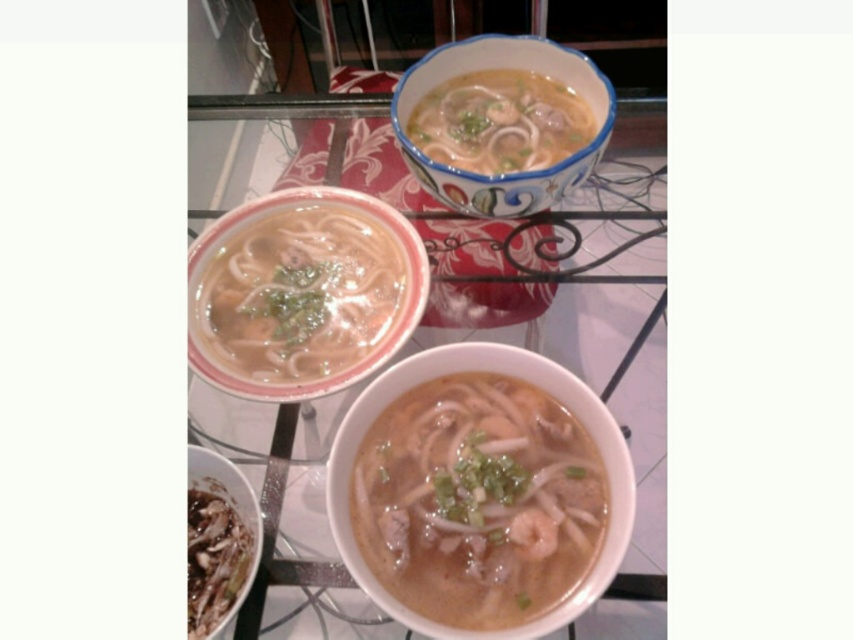
Question: Is white glossy bowl at center thinner than matte white bowl at center?

Choices:
 (A) yes
 (B) no

Answer: (A)

Question: Is matte white bowl at center smaller than decorative ceramic bowl at upper center?

Choices:
 (A) yes
 (B) no

Answer: (A)

Question: Which object is positioned closest to the white glossy bowl at center?

Choices:
 (A) matte white bowl at center
 (B) white glossy bowl at upper center
 (C) brown glossy shrimp at lower left

Answer: (A)

Question: Is white glossy bowl at upper center smaller than glassy white table at center?

Choices:
 (A) yes
 (B) no

Answer: (A)

Question: Estimate the real-world distances between objects in this image. Which object is closer to the white glossy bowl at upper center?

Choices:
 (A) glassy white table at center
 (B) decorative ceramic bowl at upper center

Answer: (B)

Question: Which of the following is the farthest from the observer?

Choices:
 (A) glassy white table at center
 (B) white glossy bowl at center
 (C) decorative ceramic bowl at upper center
 (D) white glossy bowl at upper center

Answer: (D)